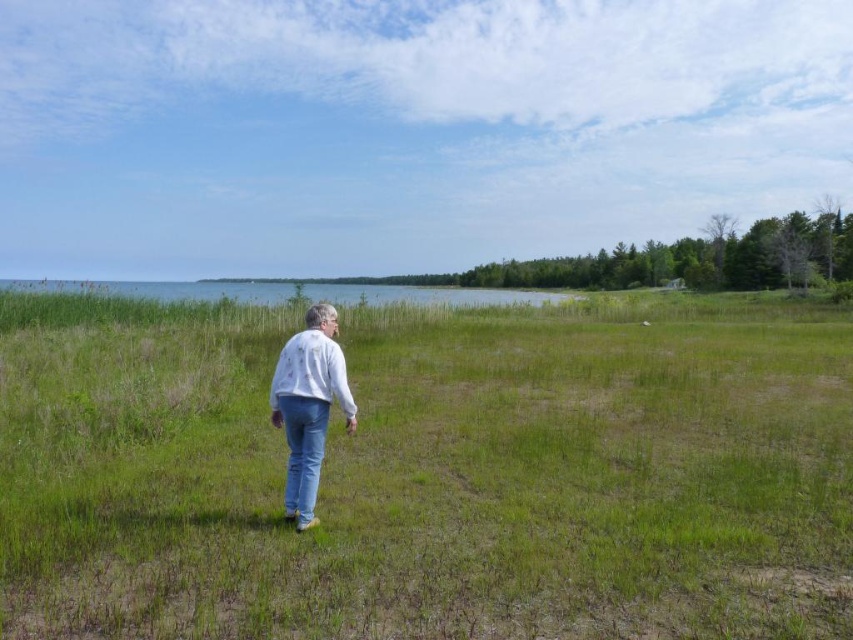
Between white cotton shirt at center and denim jeans at center, which one is positioned higher?

Positioned higher is white cotton shirt at center.

Is white cotton shirt at center thinner than denim jeans at center?

Incorrect, white cotton shirt at center's width is not less than denim jeans at center's.

Is point (302, 468) positioned after point (296, 435)?

No, (302, 468) is closer to viewer.

Identify the location of white cotton shirt at center. This screenshot has width=853, height=640. (308, 404).

Between green grass at center and denim jeans at center, which one appears on the left side from the viewer's perspective?

denim jeans at center

Is point (509, 324) positioned in front of point (280, 417)?

No, (509, 324) is behind (280, 417).

You are a GUI agent. You are given a task and a screenshot of the screen. Output one action in this format:
    pyautogui.click(x=<x>, y=<y>)
    Task: Click on the green grass at center
    The image size is (853, 640).
    Given the screenshot: What is the action you would take?
    pyautogui.click(x=432, y=474)

Image resolution: width=853 pixels, height=640 pixels. I want to click on green grass at center, so click(x=432, y=474).

Which is more to the left, green grass at center or white cotton shirt at center?

Positioned to the left is white cotton shirt at center.

Can you confirm if green grass at center is smaller than white cotton shirt at center?

No, green grass at center is not smaller than white cotton shirt at center.

The height and width of the screenshot is (640, 853). In order to click on green grass at center in this screenshot , I will do `click(432, 474)`.

This screenshot has width=853, height=640. In order to click on green grass at center in this screenshot , I will do `click(432, 474)`.